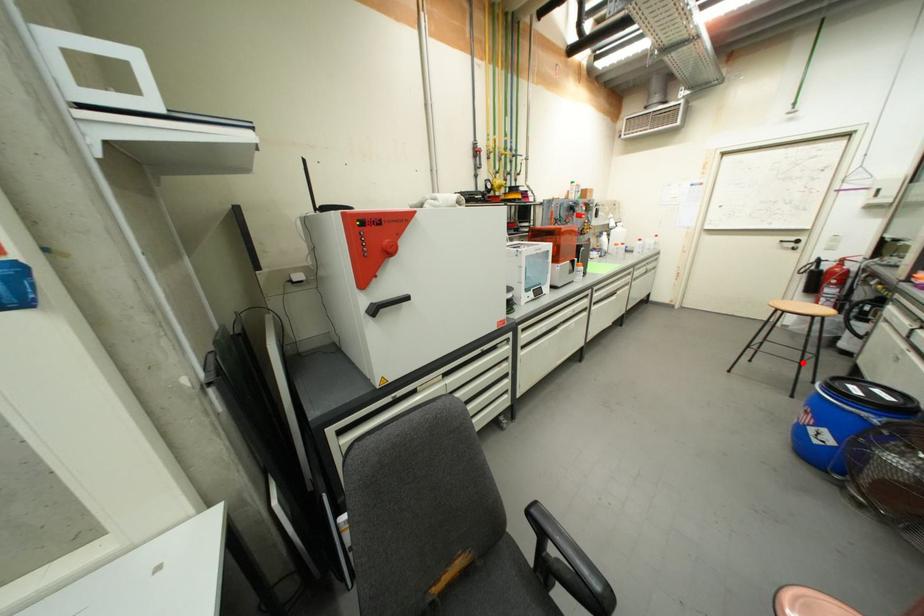
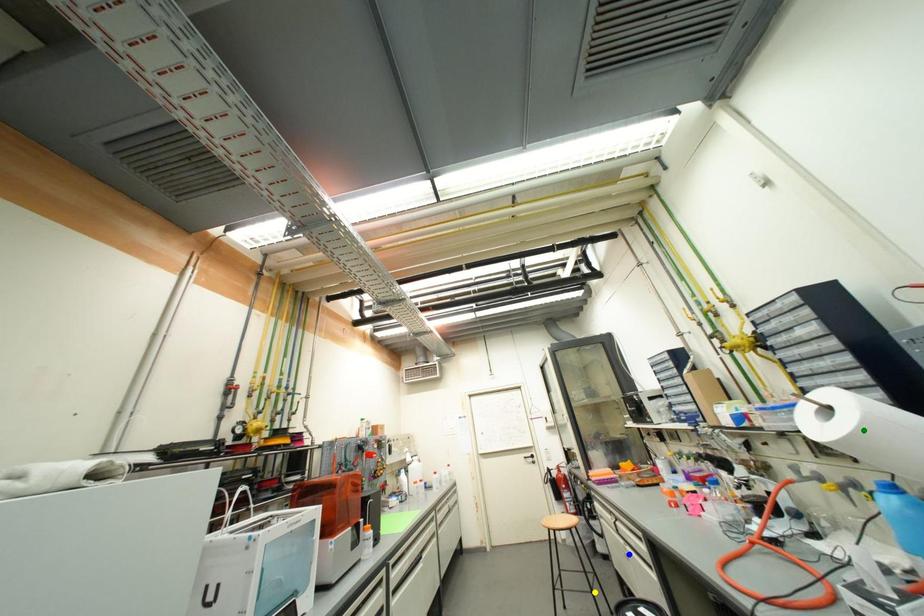
Question: I am providing you with two images of the same scene from different viewpoints. A red point is marked on the first image. You are given multiple points on the second image. Which mark in image 2 goes with the point in image 1?

Choices:
 (A) blue point
 (B) green point
 (C) yellow point

Answer: (C)